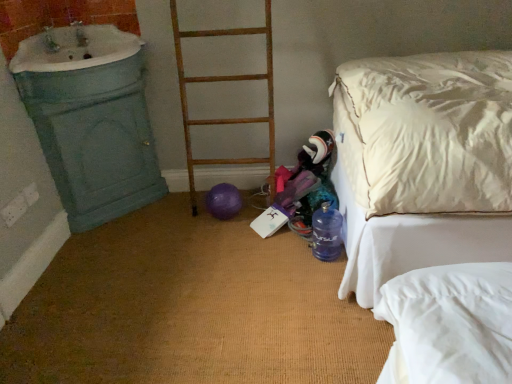
Question: Does white porcelain sink at upper left have a greater width compared to white satin bed at right?

Choices:
 (A) yes
 (B) no

Answer: (B)

Question: Is white porcelain sink at upper left bigger than white satin bed at right?

Choices:
 (A) yes
 (B) no

Answer: (B)

Question: From the image's perspective, is white porcelain sink at upper left below white satin bed at right?

Choices:
 (A) no
 (B) yes

Answer: (A)

Question: Does white porcelain sink at upper left have a lesser width compared to white satin bed at right?

Choices:
 (A) yes
 (B) no

Answer: (A)

Question: From a real-world perspective, is white porcelain sink at upper left physically below white satin bed at right?

Choices:
 (A) yes
 (B) no

Answer: (B)

Question: Would you say rusty wood ladder at center is to the left or to the right of white satin bed at right in the picture?

Choices:
 (A) right
 (B) left

Answer: (B)

Question: Which is correct: rusty wood ladder at center is inside white satin bed at right, or outside of it?

Choices:
 (A) inside
 (B) outside

Answer: (B)

Question: Considering the positions of rusty wood ladder at center and white satin bed at right in the image, is rusty wood ladder at center taller or shorter than white satin bed at right?

Choices:
 (A) tall
 (B) short

Answer: (B)

Question: Is rusty wood ladder at center wider or thinner than white satin bed at right?

Choices:
 (A) wide
 (B) thin

Answer: (B)

Question: Considering the relative positions of white porcelain sink at upper left and purple rubber balloon at center in the image provided, is white porcelain sink at upper left to the left or to the right of purple rubber balloon at center?

Choices:
 (A) left
 (B) right

Answer: (A)

Question: Is white porcelain sink at upper left inside or outside of purple rubber balloon at center?

Choices:
 (A) outside
 (B) inside

Answer: (A)

Question: From a real-world perspective, is white porcelain sink at upper left above or below purple rubber balloon at center?

Choices:
 (A) above
 (B) below

Answer: (A)

Question: From their relative heights in the image, would you say white porcelain sink at upper left is taller or shorter than purple rubber balloon at center?

Choices:
 (A) short
 (B) tall

Answer: (B)

Question: Considering the positions of point (257, 31) and point (218, 215), is point (257, 31) closer or farther from the camera than point (218, 215)?

Choices:
 (A) closer
 (B) farther

Answer: (A)

Question: From the image's perspective, is rusty wood ladder at center positioned above or below purple rubber balloon at center?

Choices:
 (A) above
 (B) below

Answer: (A)